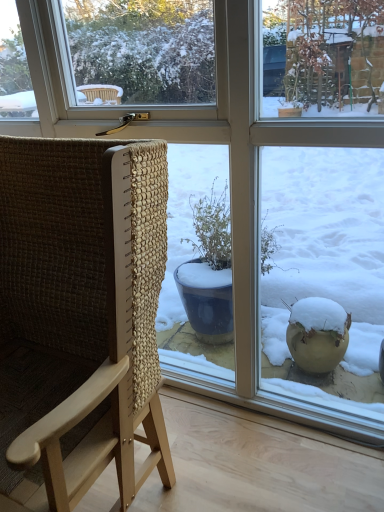
This screenshot has width=384, height=512. What do you see at coordinates (79, 317) in the screenshot? I see `woven straw chair at center` at bounding box center [79, 317].

Locate an element on the screen. Image resolution: width=384 pixels, height=512 pixels. woven straw chair at center is located at coordinates (79, 317).

What is the approximate width of woven straw chair at center?

23.06 inches.

Where is `woven straw chair at center`? woven straw chair at center is located at coordinates (79, 317).